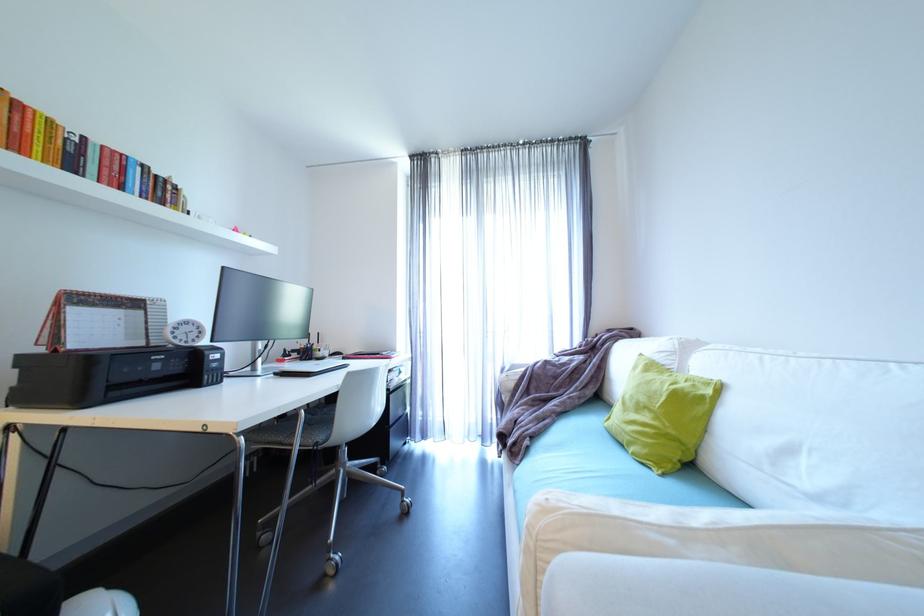
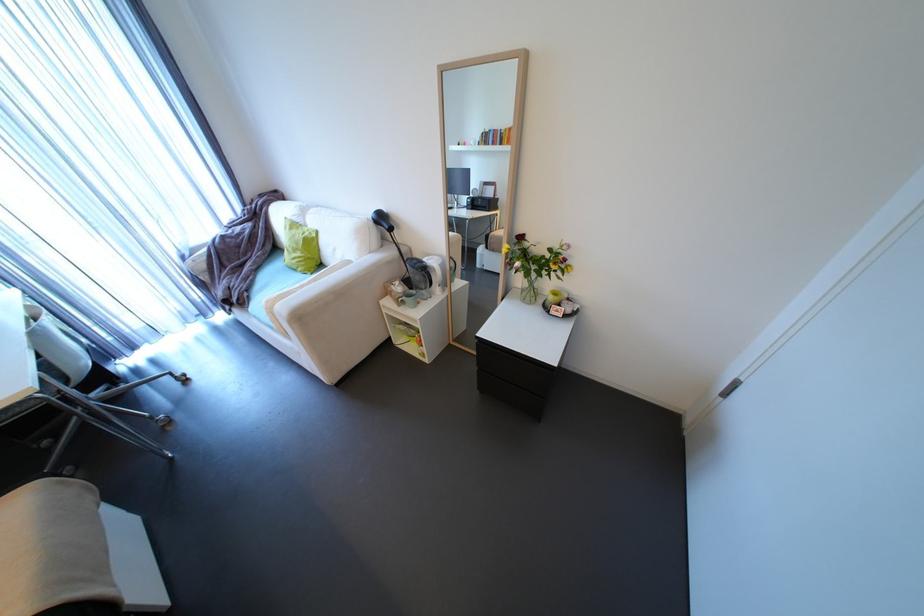
Locate, in the second image, the point that corresponds to the point at 670,476 in the first image.

(319, 274)